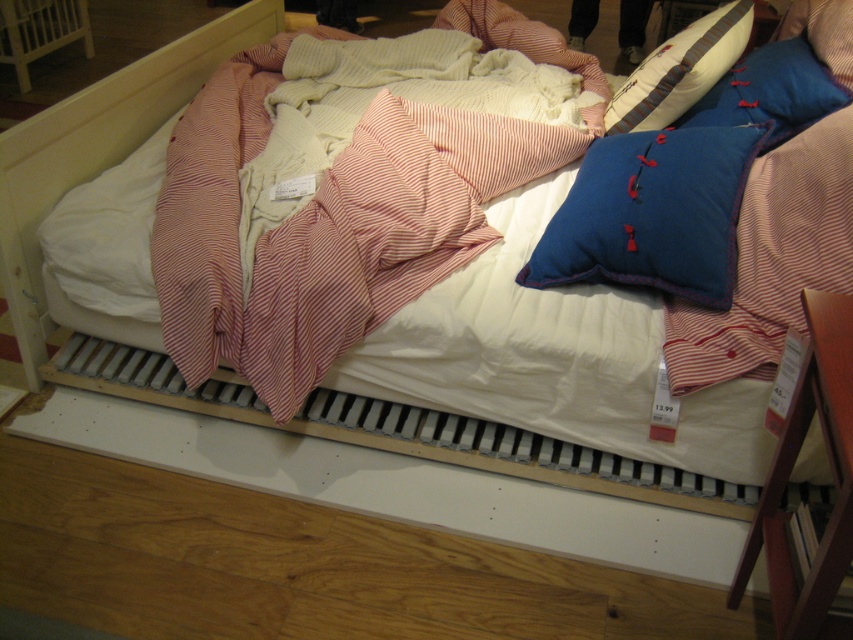
Does point (709, 99) lie in front of point (733, 61)?

That is True.

Is blue fabric pillow at upper right smaller than velvet-like beige pillow at upper right?

Indeed, blue fabric pillow at upper right has a smaller size compared to velvet-like beige pillow at upper right.

Who is more distant from viewer, (764, 120) or (693, 58)?

Positioned behind is point (693, 58).

This screenshot has width=853, height=640. In order to click on blue fabric pillow at upper right in this screenshot , I will do `click(770, 92)`.

Can you confirm if pink striped fabric at upper left is positioned to the right of blue cotton pillow at upper right?

In fact, pink striped fabric at upper left is to the left of blue cotton pillow at upper right.

At what (x,y) coordinates should I click in order to perform the action: click on pink striped fabric at upper left. Please return your answer as a coordinate pair (x, y). The image size is (853, 640). Looking at the image, I should click on (335, 216).

Does pink striped fabric at upper left appear on the left side of blue fabric pillow at upper right?

Yes, pink striped fabric at upper left is to the left of blue fabric pillow at upper right.

What do you see at coordinates (335, 216) in the screenshot? Image resolution: width=853 pixels, height=640 pixels. I see `pink striped fabric at upper left` at bounding box center [335, 216].

This screenshot has width=853, height=640. I want to click on pink striped fabric at upper left, so click(x=335, y=216).